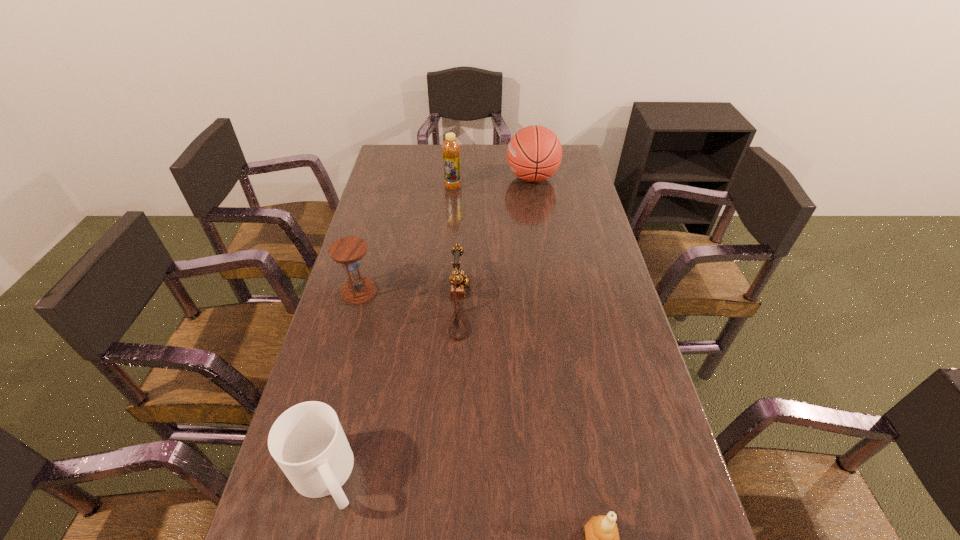
Identify which object is located as the third nearest to the hourglass. Please provide its 2D coordinates. Your answer should be formatted as a tuple, i.e. [(x, y)], where the tuple contains the x and y coordinates of a point satisfying the conditions above.

[(450, 148)]

Identify the location of vacant space that satisfies the following two spatial constraints: 1. on the front side of the hourglass; 2. on the left side of the mug. [x=309, y=476].

Where is `free space in the image that satisfies the following two spatial constraints: 1. on the back side of the bottle; 2. on the left side of the hourglass`? free space in the image that satisfies the following two spatial constraints: 1. on the back side of the bottle; 2. on the left side of the hourglass is located at coordinates (388, 187).